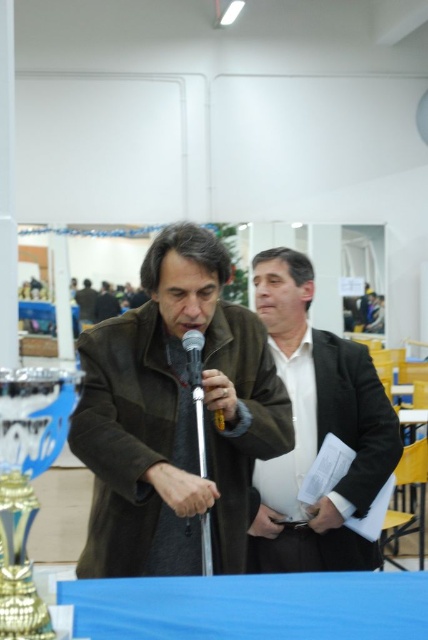
You are a photographer at the event and need to capture a photo that includes both the brown leather jacket at center and the gold metallic trophy at lower left. Based on their positions, which object should you ensure is placed lower in the frame to include both in the photo?

The gold metallic trophy at lower left should be placed lower in the frame because the brown leather jacket at center is located above it, so positioning the trophy lower will allow both to be captured within the photo.

You are a photographer at this event and want to capture a photo where the matte black suit at center is positioned above the silver metallic microphone at center. Is this possible without moving any objects?

The matte black suit at center is currently below the silver metallic microphone at center, so it is not possible to position it above without moving the objects.

You are organizing a display for an event and need to place the brown leather jacket at center and the gold metallic trophy at lower left on a shelf. The shelf has limited space. Which object should you place first to ensure both fit properly?

The brown leather jacket at center is larger than the gold metallic trophy at lower left, so you should place the gold metallic trophy at lower left first to accommodate the larger jacket afterward.